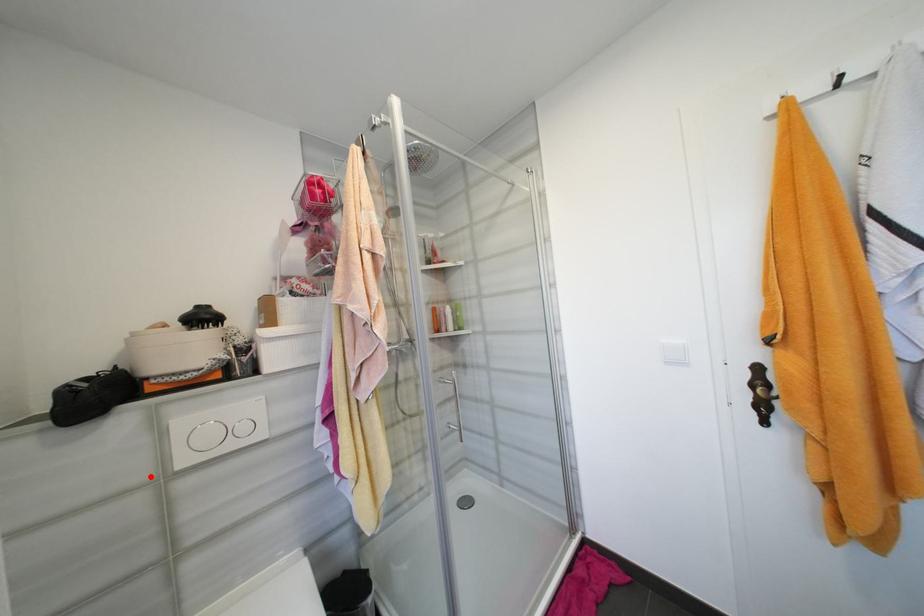
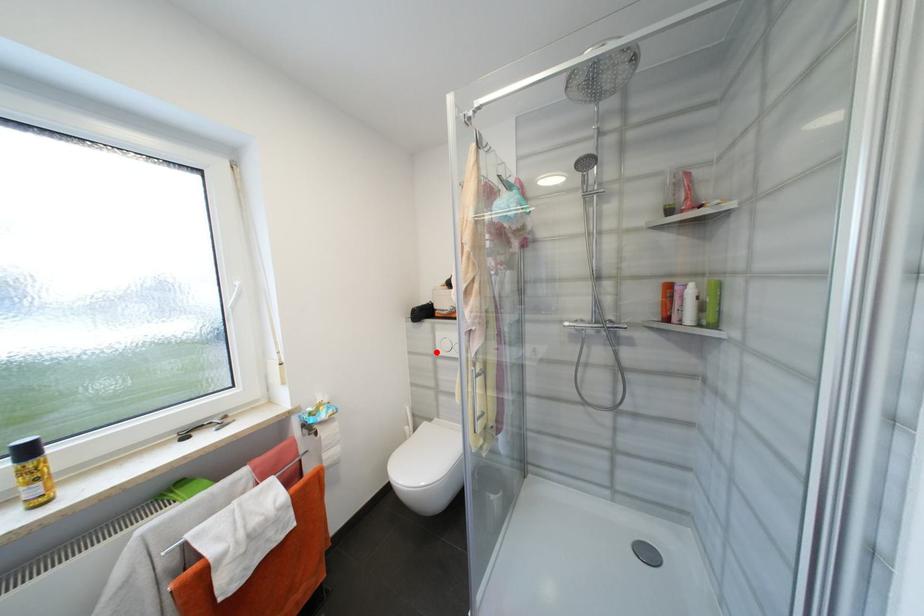
I am providing you with two images of the same scene from different viewpoints. A red point is marked on the first image and another point is marked on the second image. Are the points marked in image1 and image2 representing the same 3D position?

Yes